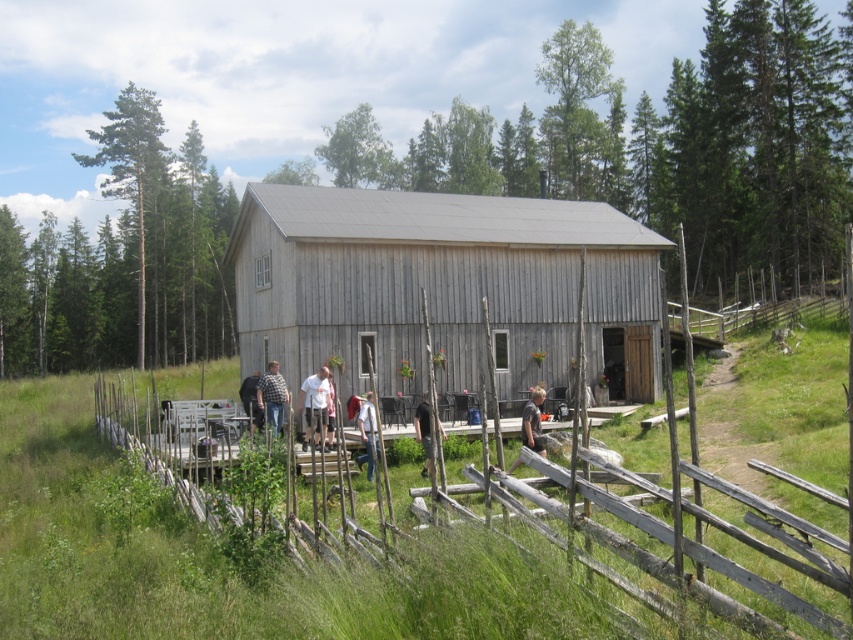
Is point (277, 384) farther from camera compared to point (421, 472)?

Yes, point (277, 384) is farther from viewer.

Is denim jeans at center bigger than light brown wooden chair at center?

Yes.

Where is `denim jeans at center`? Image resolution: width=853 pixels, height=640 pixels. denim jeans at center is located at coordinates (271, 396).

Identify the location of denim jeans at center. (271, 396).

Does light brown wooden bench at center appear on the right side of dark gray shirt at center?

Indeed, light brown wooden bench at center is positioned on the right side of dark gray shirt at center.

Who is higher up, light brown wooden bench at center or dark gray shirt at center?

dark gray shirt at center is above.

Which is behind, point (523, 426) or point (252, 385)?

The point (252, 385) is behind.

Find the location of a particular element. light brown wooden bench at center is located at coordinates (532, 420).

Does wooden barn at center come in front of dark gray shirt at center?

No, it is behind dark gray shirt at center.

Which is behind, point (659, 332) or point (245, 401)?

The point (659, 332) is more distant.

Is point (339, 192) less distant than point (253, 380)?

No, (339, 192) is further to viewer.

Identify the location of wooden barn at center. (444, 288).